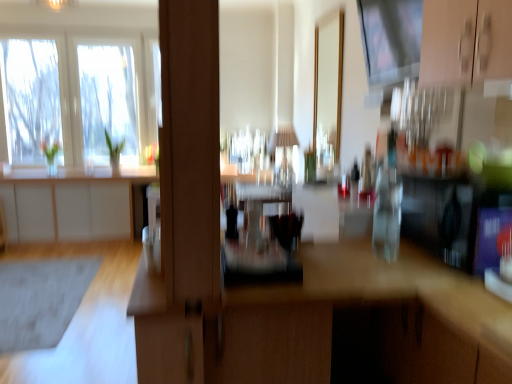
Where is `vacant region above gray matte rug at lower left (from a real-world perspective)`? vacant region above gray matte rug at lower left (from a real-world perspective) is located at coordinates (40, 290).